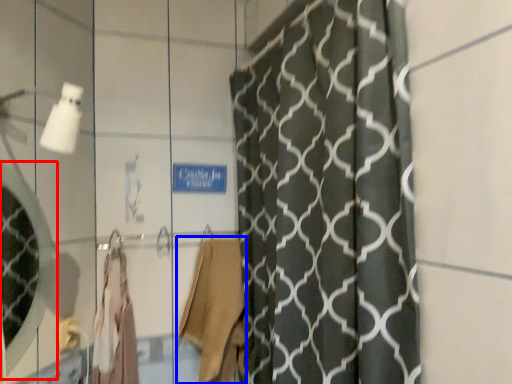
Question: Which of the following is the closest to the observer, mirror (highlighted by a red box) or robe (highlighted by a blue box)?

Choices:
 (A) mirror
 (B) robe

Answer: (A)